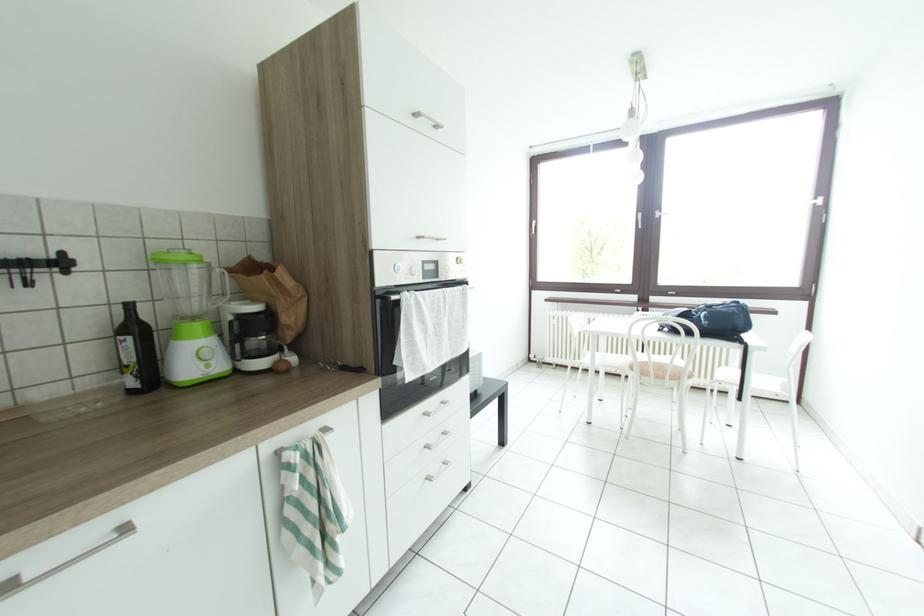
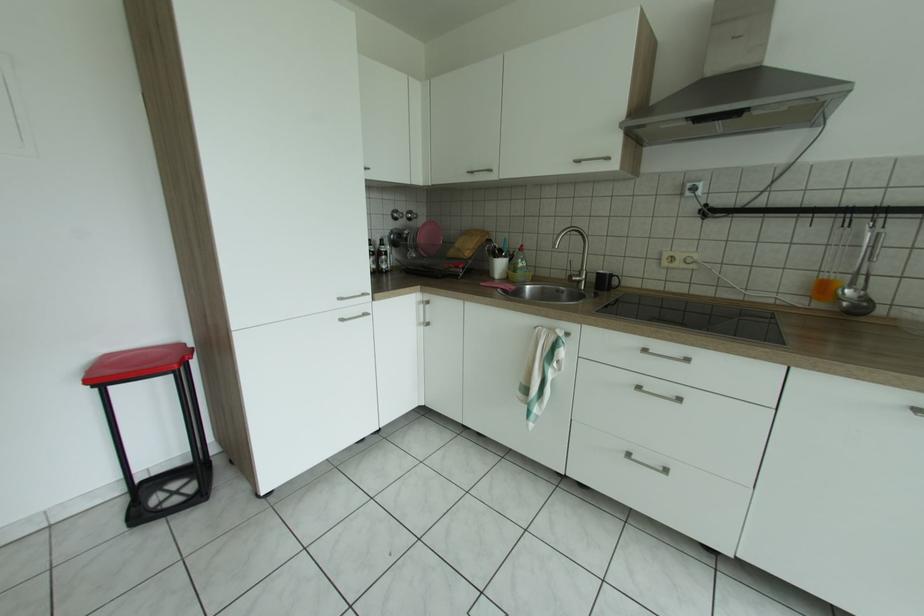
Based on the continuous images, in which direction is the camera rotating?

The camera rotated toward left-down.